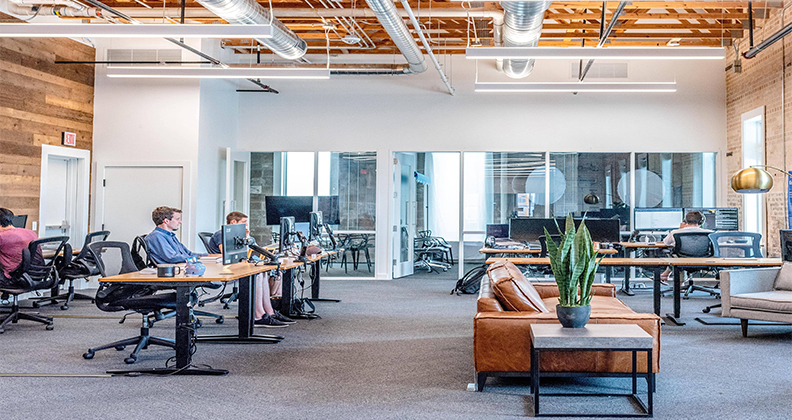
This screenshot has height=420, width=792. I want to click on exit sign, so click(70, 142).